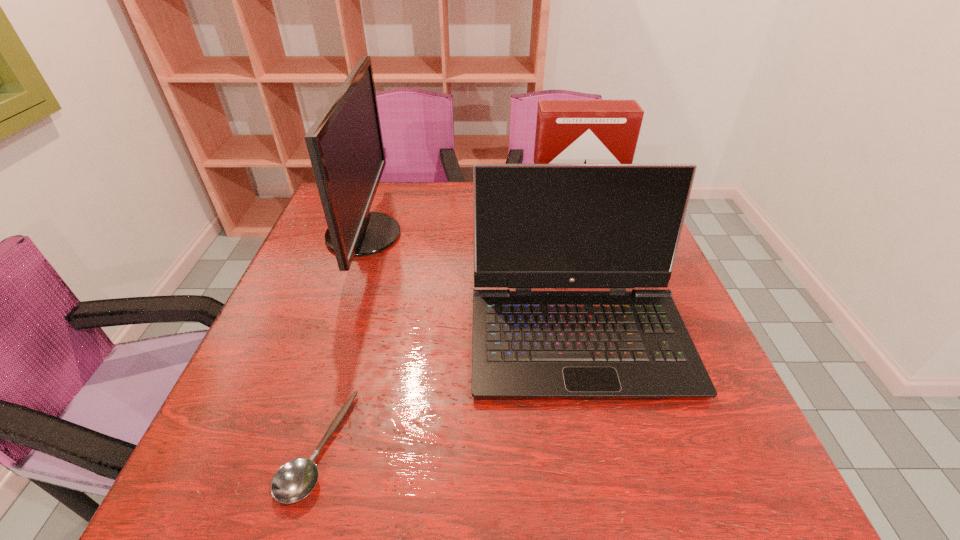
The height and width of the screenshot is (540, 960). I want to click on monitor, so click(x=345, y=145).

You are a GUI agent. You are given a task and a screenshot of the screen. Output one action in this format:
    pyautogui.click(x=<x>, y=<y>)
    Task: Click on the cigarette_case
    
    Given the screenshot: What is the action you would take?
    pyautogui.click(x=567, y=131)

Locate an element on the screen. This screenshot has height=540, width=960. laptop computer is located at coordinates point(617,226).

You are a GUI agent. You are given a task and a screenshot of the screen. Output one action in this format:
    pyautogui.click(x=<x>, y=<y>)
    Task: Click on the shortest object
    The image size is (960, 540).
    Given the screenshot: What is the action you would take?
    coord(294,480)

I want to click on vacant region located on the screen side of the monitor, so click(x=444, y=235).

In order to click on vacant space located 0.350m on the front-facing side of the cigarette_case in this screenshot , I will do `click(598, 338)`.

The height and width of the screenshot is (540, 960). What are the coordinates of `vacant area located on the screen of the laptop computer` in the screenshot? It's located at [x=600, y=433].

This screenshot has height=540, width=960. Find the location of `free spot located on the back of the ladle`. free spot located on the back of the ladle is located at coordinates (355, 318).

Where is `monitor at the far edge`? monitor at the far edge is located at coordinates (345, 145).

Identify the location of cigarette_case at the far edge. The height and width of the screenshot is (540, 960). (567, 131).